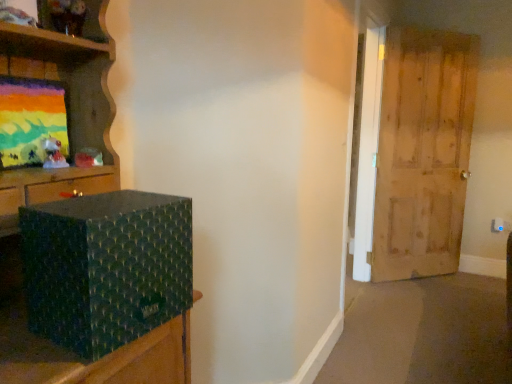
Where is `green textured box at left`? green textured box at left is located at coordinates (106, 267).

How many degrees apart are the facing directions of green textured box at left and matte painted canvas at upper left?

5 degrees separate the facing orientations of green textured box at left and matte painted canvas at upper left.

Does green textured box at left have a greater height compared to matte painted canvas at upper left?

Yes.

What are the coordinates of `box on the right of matte painted canvas at upper left` in the screenshot? It's located at (106, 267).

Based on the photo, is matte painted canvas at upper left bigger than wooden door at right?

Actually, matte painted canvas at upper left might be smaller than wooden door at right.

How different are the orientations of matte painted canvas at upper left and wooden door at right in degrees?

They differ by 45.6 degrees in their facing directions.

Considering the sizes of objects matte painted canvas at upper left and wooden door at right in the image provided, who is thinner, matte painted canvas at upper left or wooden door at right?

Thinner between the two is matte painted canvas at upper left.

From the picture: Is the position of matte painted canvas at upper left more distant than that of wooden door at right?

No, it is in front of wooden door at right.

From the image's perspective, is wooden door at right positioned above or below matte painted canvas at upper left?

Clearly, from the image's perspective, wooden door at right is above matte painted canvas at upper left.

Is wooden door at right situated inside matte painted canvas at upper left or outside?

wooden door at right is spatially situated outside matte painted canvas at upper left.

What's the angular difference between wooden door at right and matte painted canvas at upper left's facing directions?

wooden door at right and matte painted canvas at upper left are facing 45.6 degrees away from each other.

Between wooden door at right and matte painted canvas at upper left, which one has smaller size?

With smaller size is matte painted canvas at upper left.

Considering the relative sizes of wooden door at right and green textured box at left in the image provided, is wooden door at right wider than green textured box at left?

Incorrect, the width of wooden door at right does not surpass that of green textured box at left.

Is wooden door at right directly adjacent to green textured box at left?

They are not placed beside each other.

Considering the positions of objects wooden door at right and green textured box at left in the image provided, who is more to the right, wooden door at right or green textured box at left?

wooden door at right is more to the right.

Is matte painted canvas at upper left thinner than green textured box at left?

Indeed, matte painted canvas at upper left has a lesser width compared to green textured box at left.

From their relative heights in the image, would you say matte painted canvas at upper left is taller or shorter than green textured box at left?

In the image, matte painted canvas at upper left appears to be shorter than green textured box at left.

Can you tell me how much matte painted canvas at upper left and green textured box at left differ in facing direction?

The facing directions of matte painted canvas at upper left and green textured box at left are 5 degrees apart.

Is green textured box at left bigger than wooden door at right?

Incorrect, green textured box at left is not larger than wooden door at right.

Looking at this image, considering the relative sizes of green textured box at left and wooden door at right in the image provided, is green textured box at left thinner than wooden door at right?

In fact, green textured box at left might be wider than wooden door at right.

This screenshot has height=384, width=512. What are the coordinates of `box lying in front of the matte painted canvas at upper left` in the screenshot? It's located at (106, 267).

Image resolution: width=512 pixels, height=384 pixels. Find the location of `picture frame on the left of wooden door at right`. picture frame on the left of wooden door at right is located at coordinates (33, 123).

From the image, which object appears to be nearer to wooden door at right, green textured box at left or matte painted canvas at upper left?

The object closer to wooden door at right is green textured box at left.

Which object lies nearer to the anchor point wooden door at right, matte painted canvas at upper left or green textured box at left?

green textured box at left is positioned closer to the anchor wooden door at right.

Estimate the real-world distances between objects in this image. Which object is closer to matte painted canvas at upper left, green textured box at left or wooden door at right?

green textured box at left.

Which object lies nearer to the anchor point matte painted canvas at upper left, wooden door at right or green textured box at left?

green textured box at left.

Looking at the image, which one is located closer to green textured box at left, matte painted canvas at upper left or wooden door at right?

matte painted canvas at upper left.

Based on their spatial positions, is wooden door at right or matte painted canvas at upper left further from green textured box at left?

wooden door at right is further to green textured box at left.

Where is `picture frame between green textured box at left and wooden door at right along the z-axis`? This screenshot has width=512, height=384. picture frame between green textured box at left and wooden door at right along the z-axis is located at coordinates coord(33,123).